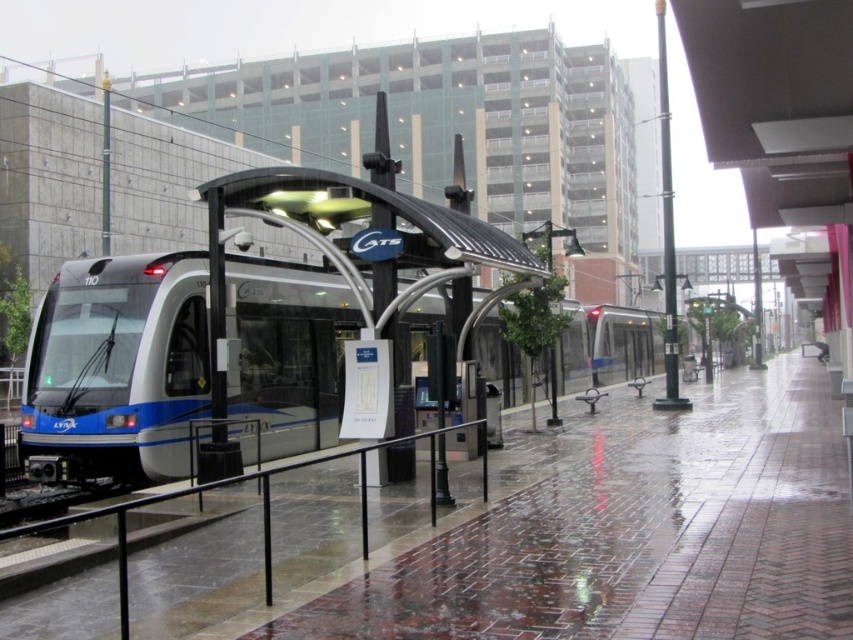
Question: Is metallic blue train at left above black metal/rail at lower left?

Choices:
 (A) no
 (B) yes

Answer: (B)

Question: Is metallic blue train at left wider than black metal/rail at lower left?

Choices:
 (A) yes
 (B) no

Answer: (A)

Question: Which point is farther to the camera?

Choices:
 (A) (440, 435)
 (B) (90, 269)

Answer: (B)

Question: Which point appears closest to the camera in this image?

Choices:
 (A) pos(461,426)
 (B) pos(184,268)

Answer: (B)

Question: Which of the following is the closest to the observer?

Choices:
 (A) metallic blue train at left
 (B) black metal/rail at lower left

Answer: (B)

Question: Does metallic blue train at left lie in front of black metal/rail at lower left?

Choices:
 (A) no
 (B) yes

Answer: (A)